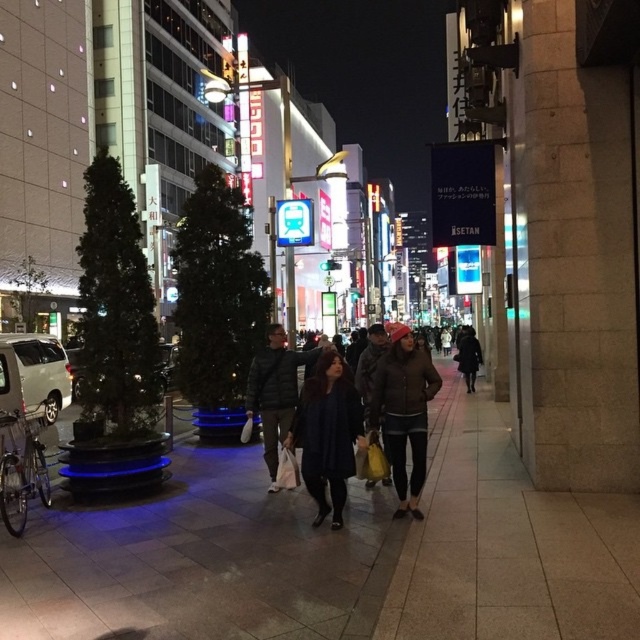
Does dark blue fabric coat at center have a lesser height compared to dark green puffer jacket at center?

Yes.

What do you see at coordinates (326, 433) in the screenshot? The height and width of the screenshot is (640, 640). I see `dark blue fabric coat at center` at bounding box center [326, 433].

Identify the location of dark blue fabric coat at center. (x=326, y=433).

Which is in front, point (476, 476) or point (410, 394)?

Positioned in front is point (410, 394).

Does slate gray pavement at center have a lesser height compared to matte brown jacket at center?

Yes, slate gray pavement at center is shorter than matte brown jacket at center.

Locate an element on the screen. The height and width of the screenshot is (640, 640). slate gray pavement at center is located at coordinates (333, 554).

Who is shorter, dark green puffer jacket at center or dark gray coat at center?

dark gray coat at center

Locate an element on the screen. This screenshot has width=640, height=640. dark green puffer jacket at center is located at coordinates (275, 392).

Is point (253, 356) closer to viewer compared to point (472, 371)?

Yes.

Identify the location of dark green puffer jacket at center. (275, 392).